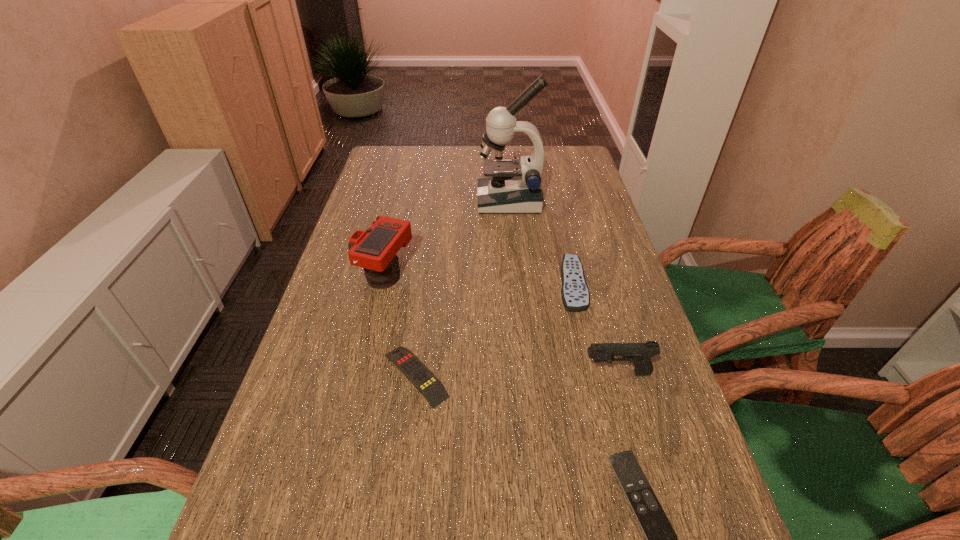
I want to click on the fourth object from right to left, so click(x=513, y=186).

Find the location of a particular element. microscope is located at coordinates (513, 186).

This screenshot has width=960, height=540. I want to click on camera, so click(x=375, y=249).

This screenshot has width=960, height=540. Identify the location of pistol. (640, 354).

Image resolution: width=960 pixels, height=540 pixels. I want to click on the farthest remote control, so click(x=575, y=296).

The image size is (960, 540). I want to click on the leftmost remote control, so click(425, 382).

At what (x,y) coordinates should I click in order to perform the action: click on free space located on the back of the microscope. Please return your answer as a coordinate pair (x, y). Looking at the image, I should click on (505, 153).

Find the location of a particular element. free space located on the back of the camera is located at coordinates coord(400,212).

I want to click on free space located at the barrel of the pistol, so click(x=466, y=373).

The height and width of the screenshot is (540, 960). I want to click on free space located at the barrel of the pistol, so click(422, 373).